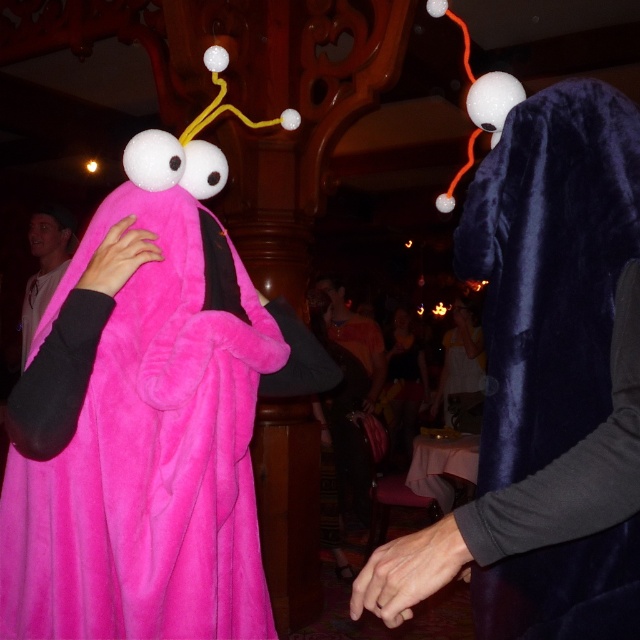
Can you confirm if velvet dark blue robe at right is smaller than matte white shirt at left?

Yes.

How far apart are velvet dark blue robe at right and matte white shirt at left?

velvet dark blue robe at right and matte white shirt at left are 2.35 meters apart.

This screenshot has height=640, width=640. I want to click on velvet dark blue robe at right, so click(x=548, y=269).

Locate an element on the screen. This screenshot has height=640, width=640. velvet dark blue robe at right is located at coordinates (548, 269).

Between matte white shirt at left and velvet blue mask at center, which one has more height?

Standing taller between the two is velvet blue mask at center.

Which is more to the right, matte white shirt at left or velvet blue mask at center?

From the viewer's perspective, velvet blue mask at center appears more on the right side.

Is point (28, 342) less distant than point (477, 336)?

Yes, it is.

Where is `matte white shirt at left`? The width and height of the screenshot is (640, 640). matte white shirt at left is located at coordinates (45, 266).

Can you confirm if velvet fabric dress at center is positioned above matte white shirt at left?

Actually, velvet fabric dress at center is below matte white shirt at left.

At what (x,y) coordinates should I click in order to perform the action: click on velvet fabric dress at center. Please return your answer as a coordinate pair (x, y). The height and width of the screenshot is (640, 640). Looking at the image, I should click on (403, 381).